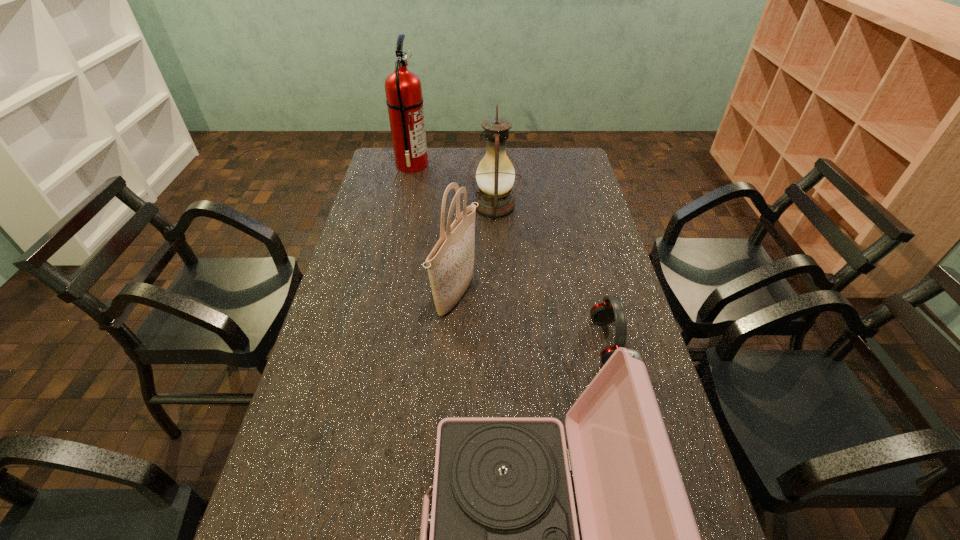
In the image, there is a desktop. What are the coordinates of `vacant space at the far right corner` in the screenshot? It's located at (566, 164).

This screenshot has height=540, width=960. What are the coordinates of `free spot between the oil lamp and the shopping bag` in the screenshot? It's located at (475, 252).

In order to click on blank region between the earphone and the leftmost object in this screenshot , I will do `click(510, 254)`.

At what (x,y) coordinates should I click in order to perform the action: click on free space between the second farthest object and the shopping bag. Please return your answer as a coordinate pair (x, y). Looking at the image, I should click on (475, 252).

At what (x,y) coordinates should I click in order to perform the action: click on the fourth closest object to the shopping bag. Please return your answer as a coordinate pair (x, y). Image resolution: width=960 pixels, height=540 pixels. Looking at the image, I should click on (404, 100).

Find the location of a particular element. object that is the third closest to the shopping bag is located at coordinates (604, 313).

Image resolution: width=960 pixels, height=540 pixels. I want to click on blank area in the image that satisfies the following two spatial constraints: 1. at the nozzle of the tallest object; 2. on the left side of the fourth nearest object, so click(x=403, y=206).

This screenshot has height=540, width=960. In order to click on free space in the image that satisfies the following two spatial constraints: 1. at the nozzle of the tallest object; 2. on the right side of the shopping bag in this screenshot , I will do `click(383, 297)`.

The image size is (960, 540). In order to click on blank area in the image that satisfies the following two spatial constraints: 1. at the nozzle of the leftmost object; 2. on the left side of the shopping bag in this screenshot , I will do `click(383, 297)`.

This screenshot has height=540, width=960. Identify the location of vacant space that satisfies the following two spatial constraints: 1. at the nozzle of the fourth nearest object; 2. on the left side of the farthest object. [x=403, y=206].